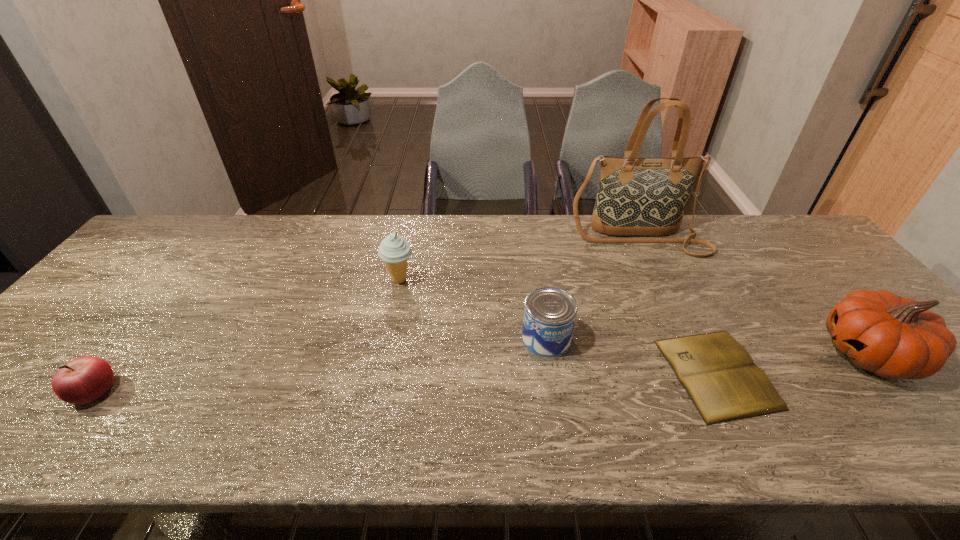
The image size is (960, 540). I want to click on vacant space located on the front-facing side of the tallest object, so click(661, 289).

This screenshot has height=540, width=960. Identify the location of vacant point located 0.110m on the face of the rightmost object. tap(776, 354).

Locate an element on the screen. This screenshot has width=960, height=540. free space located on the face of the rightmost object is located at coordinates (743, 354).

Where is `vacant space located on the face of the rightmost object`? Image resolution: width=960 pixels, height=540 pixels. vacant space located on the face of the rightmost object is located at coordinates (743, 354).

Image resolution: width=960 pixels, height=540 pixels. What are the coordinates of `blank area located on the right of the icecream` in the screenshot? It's located at (437, 280).

At what (x,y) coordinates should I click in order to perform the action: click on blank space located on the front label of the fourth object from right to left. Please return your answer as a coordinate pair (x, y). Looking at the image, I should click on (555, 394).

In order to click on vacant space situated 0.120m on the back of the fifth tallest object in this screenshot , I will do `click(138, 333)`.

I want to click on free region located 0.250m on the right of the book, so click(876, 374).

Where is `object that is at the far edge`? object that is at the far edge is located at coordinates (636, 196).

Identify the location of object located in the near edge section of the desktop. The width and height of the screenshot is (960, 540). (719, 375).